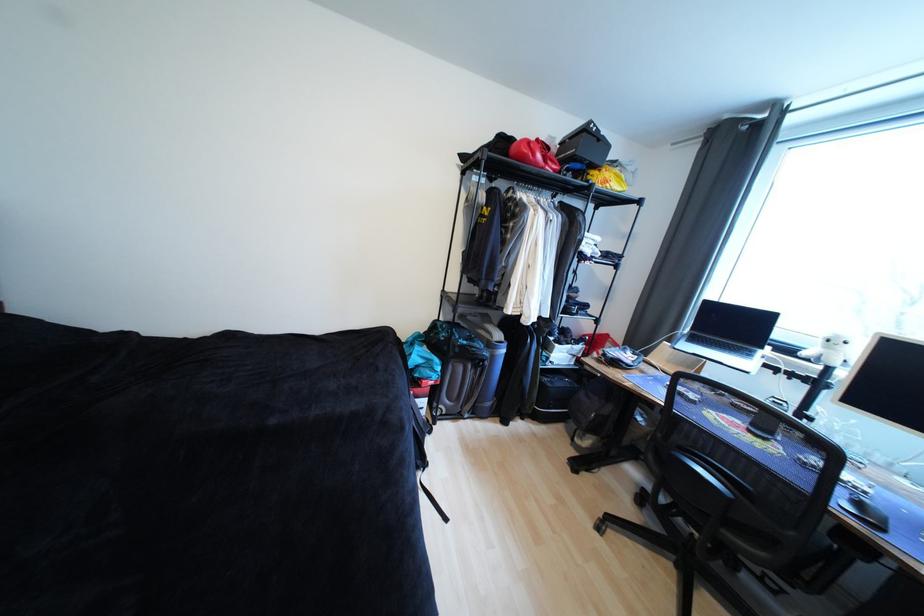
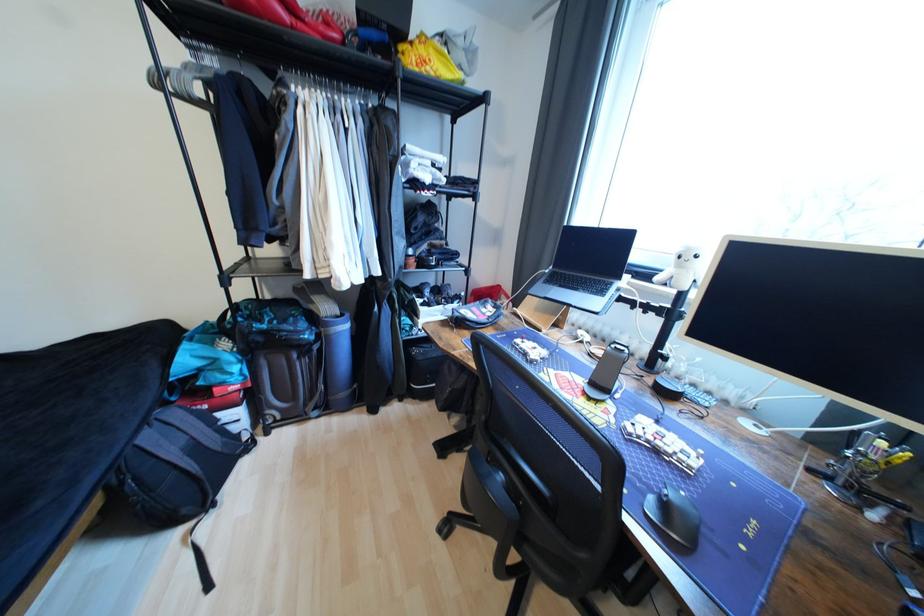
Locate, in the second image, the point that corresponds to point 599,174 in the first image.

(407, 49)